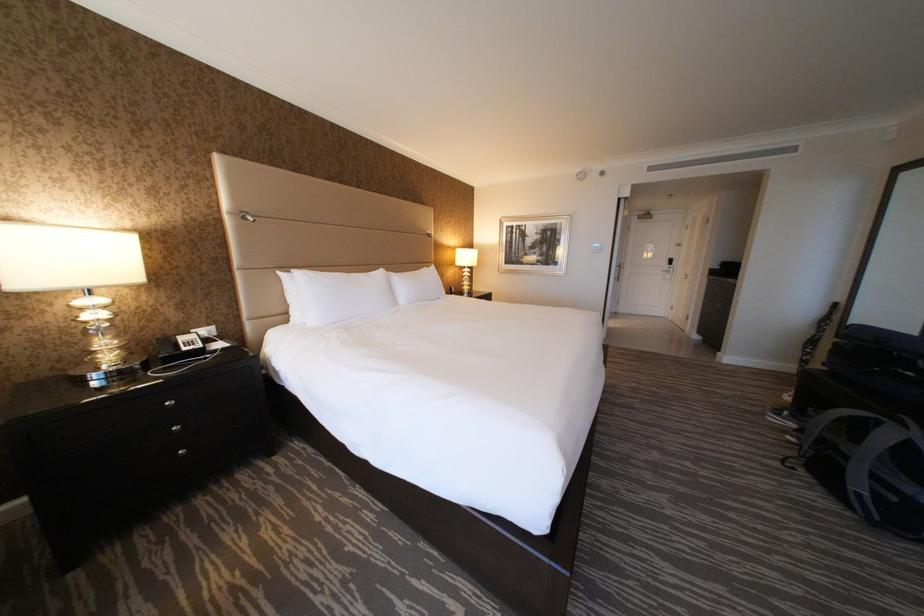
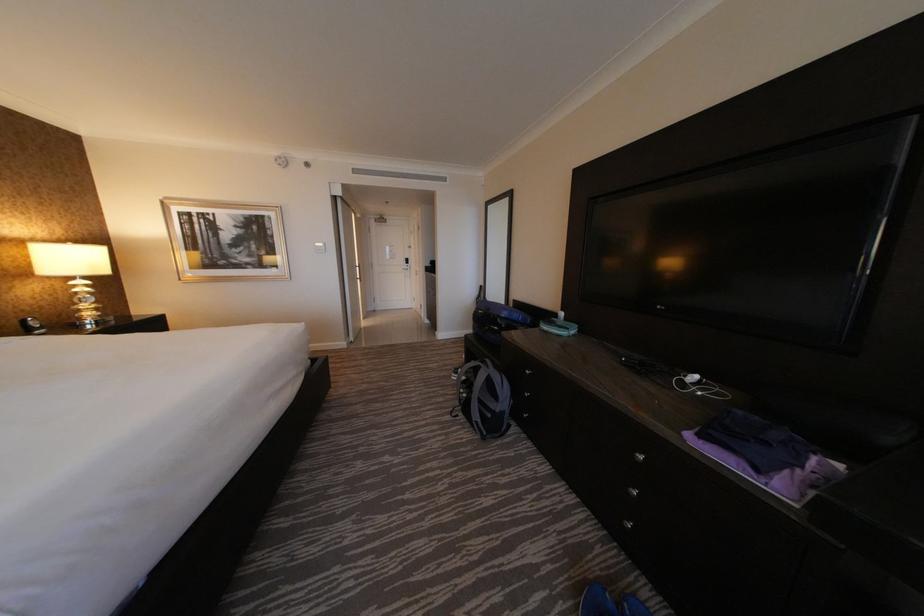
Question: How did the camera likely rotate?

Choices:
 (A) Left
 (B) Right
 (C) Up
 (D) Down

Answer: (B)